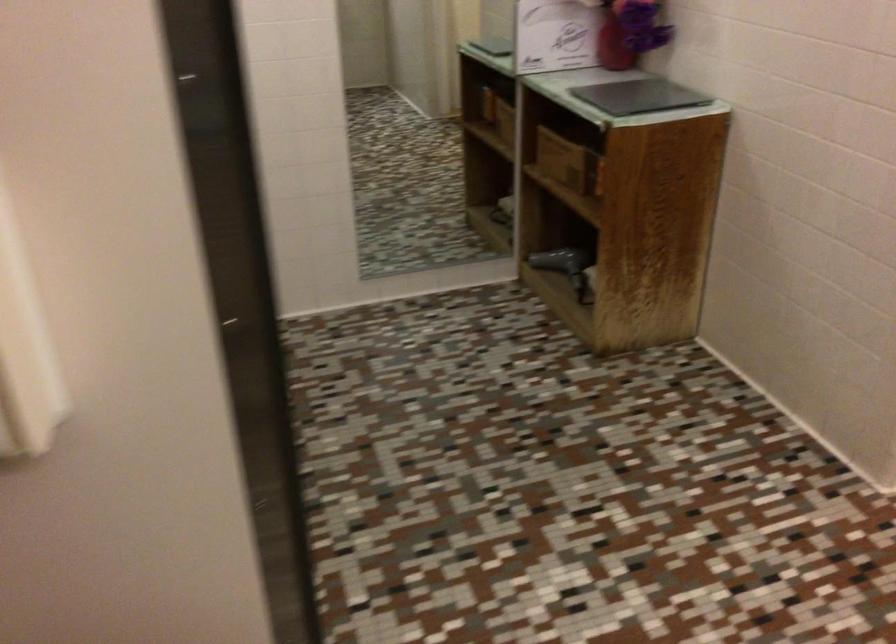
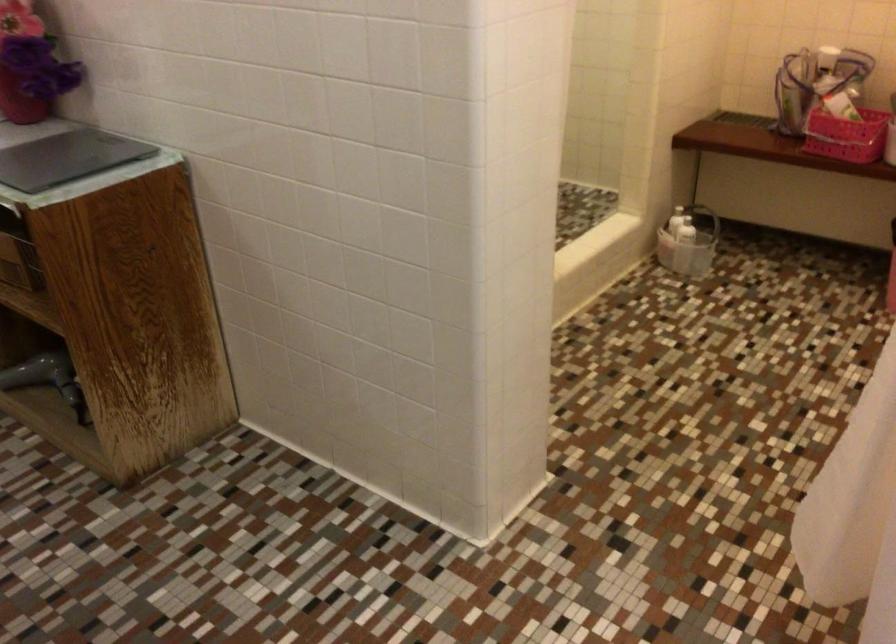
Question: Based on the continuous images, in which direction is the camera rotating? Reply with the corresponding letter.

Choices:
 (A) Left
 (B) Right
 (C) Up
 (D) Down

Answer: (B)